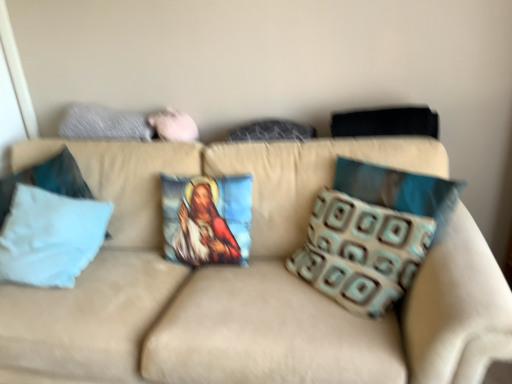
Question: Does point (42, 165) appear closer or farther from the camera than point (291, 124)?

Choices:
 (A) closer
 (B) farther

Answer: (A)

Question: Considering the relative positions of white fabric pillow at left, arranged as the seventh pillow when viewed from the right, and textured fabric pillow at center, arranged as the fifth pillow when viewed from the left, in the image provided, is white fabric pillow at left, arranged as the seventh pillow when viewed from the right, to the left or to the right of textured fabric pillow at center, arranged as the fifth pillow when viewed from the left,?

Choices:
 (A) right
 (B) left

Answer: (B)

Question: Estimate the real-world distances between objects in this image. Which object is closer to the textured fabric pillow at center, arranged as the fifth pillow when viewed from the left?

Choices:
 (A) white fabric pillow at left, the 2th pillow in the left-to-right sequence
 (B) brown patterned pillow at right, the 1th pillow positioned from the right
 (C) beige fabric couch at center
 (D) textured gray pillow at upper left, placed as the fifth pillow when sorted from right to left
 (E) printed fabric pillow with religious image at center, placed as the fourth pillow when sorted from right to left

Answer: (E)

Question: Which of these objects is positioned farthest from the white fabric pillow at left, the 2th pillow in the left-to-right sequence?

Choices:
 (A) brown textured pillow at right, the 6th pillow positioned from the left
 (B) white fabric pillow at left, arranged as the seventh pillow when viewed from the right
 (C) textured gray pillow at upper left, placed as the fifth pillow when sorted from right to left
 (D) brown patterned pillow at right, the 1th pillow positioned from the right
 (E) beige fabric couch at center

Answer: (D)